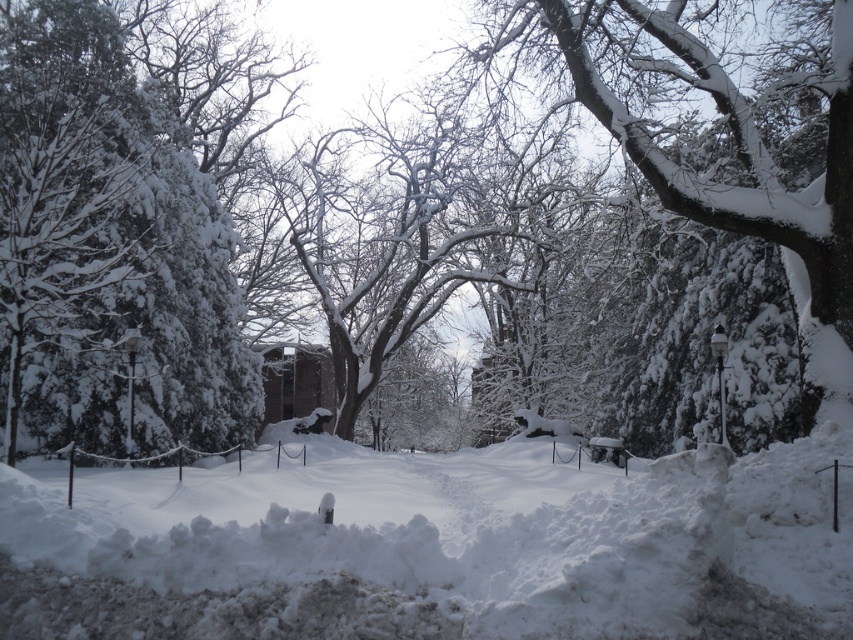
The image size is (853, 640). What do you see at coordinates (436, 547) in the screenshot?
I see `white fluffy snow at center` at bounding box center [436, 547].

Which of these two, white fluffy snow at center or snow-covered tree at upper right, stands taller?

snow-covered tree at upper right

Is point (613, 563) more distant than point (671, 340)?

No, (613, 563) is in front of (671, 340).

Identify the location of white fluffy snow at center. (436, 547).